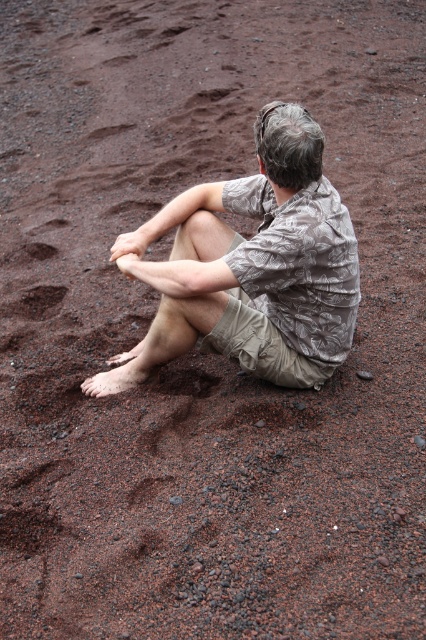
Can you confirm if camouflage fabric shirt at center is positioned above brown dirt footprint at lower left?

Correct, camouflage fabric shirt at center is located above brown dirt footprint at lower left.

Which is in front, point (187, 342) or point (13, 307)?

Point (187, 342) is in front.

Find the location of a particular element. Image resolution: width=426 pixels, height=640 pixels. camouflage fabric shirt at center is located at coordinates (250, 268).

Is brown dirt footprint at lower center to the right of brown dirt footprint at lower left from the viewer's perspective?

Correct, you'll find brown dirt footprint at lower center to the right of brown dirt footprint at lower left.

Is brown dirt footprint at lower center wider than brown dirt footprint at lower left?

Correct, the width of brown dirt footprint at lower center exceeds that of brown dirt footprint at lower left.

Who is more distant from viewer, (203, 385) or (46, 285)?

The point (46, 285) is behind.

Locate an element on the screen. brown dirt footprint at lower center is located at coordinates (184, 380).

Is point (311, 157) behind point (166, 369)?

That is False.

In the scene shown: Can you confirm if camouflage fabric shirt at center is positioned to the right of brown dirt footprint at lower center?

Indeed, camouflage fabric shirt at center is positioned on the right side of brown dirt footprint at lower center.

What do you see at coordinates (250, 268) in the screenshot?
I see `camouflage fabric shirt at center` at bounding box center [250, 268].

In order to click on camouflage fabric shirt at center in this screenshot , I will do `click(250, 268)`.